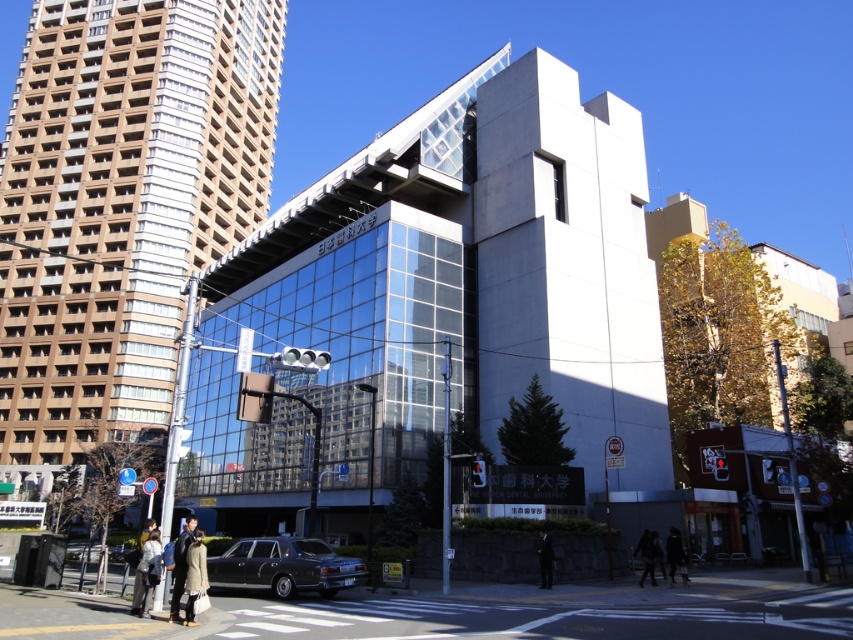
Question: Does shiny black sedan at lower center come behind dark fabric coat at lower center?

Choices:
 (A) no
 (B) yes

Answer: (A)

Question: Which object is the closest to the dark gray coat at lower right?

Choices:
 (A) matte gray coat at lower center
 (B) light beige coat at lower left
 (C) black suit at center

Answer: (C)

Question: Which point is closer to the camera taking this photo?

Choices:
 (A) click(x=314, y=556)
 (B) click(x=662, y=545)
 (C) click(x=155, y=552)
 (D) click(x=172, y=600)

Answer: (D)

Question: Among these points, which one is farthest from the camera?

Choices:
 (A) (669, 529)
 (B) (225, 560)
 (C) (645, 529)

Answer: (C)

Question: Is light beige coat at lower left wider than dark gray coat at lower right?

Choices:
 (A) no
 (B) yes

Answer: (B)

Question: Does shiny black sedan at lower center lie behind black suit at center?

Choices:
 (A) no
 (B) yes

Answer: (A)